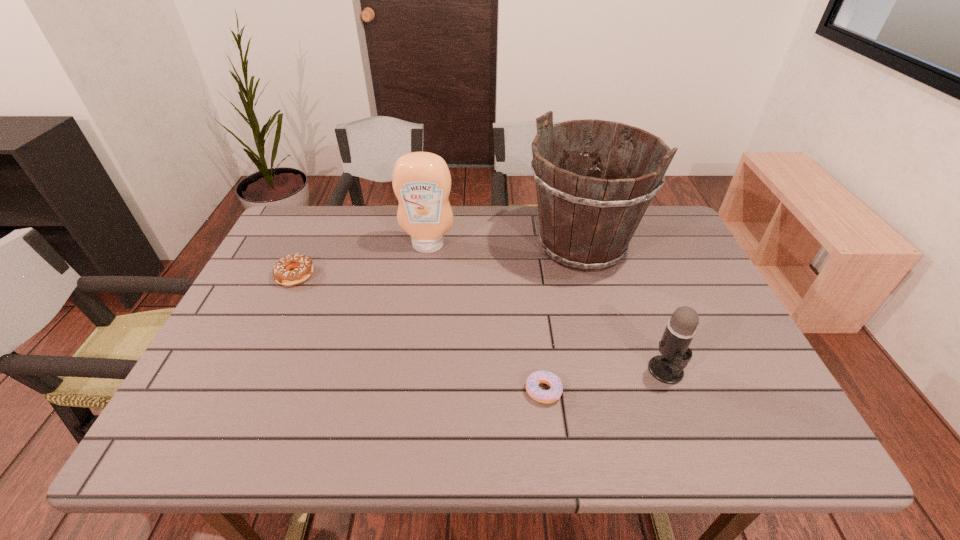
Image resolution: width=960 pixels, height=540 pixels. Find the location of `vacant region located 0.310m on the back of the microphone`. vacant region located 0.310m on the back of the microphone is located at coordinates (x=628, y=268).

This screenshot has width=960, height=540. In order to click on free location located 0.100m on the right of the second shortest object in this screenshot , I will do `click(350, 275)`.

You are a GUI agent. You are given a task and a screenshot of the screen. Output one action in this format:
    pyautogui.click(x=<x>, y=<y>)
    Task: Click on the vacant space located on the right of the right doughnut
    
    Given the screenshot: What is the action you would take?
    click(x=713, y=390)

Locate an element on the screen. bucket positioned at the far edge is located at coordinates (587, 221).

At what (x,y) coordinates should I click in order to perform the action: click on condiment at the far edge. Please return your answer as a coordinate pair (x, y). Looking at the image, I should click on (421, 181).

I want to click on object that is at the left edge, so click(283, 274).

Locate an element on the screen. object at the right edge is located at coordinates (587, 221).

Where is `object positioned at the far right corner`? The width and height of the screenshot is (960, 540). object positioned at the far right corner is located at coordinates (587, 221).

The image size is (960, 540). Identify the location of vacant area at the far edge. (486, 248).

Where is `vacant space at the near edge`? vacant space at the near edge is located at coordinates (425, 437).